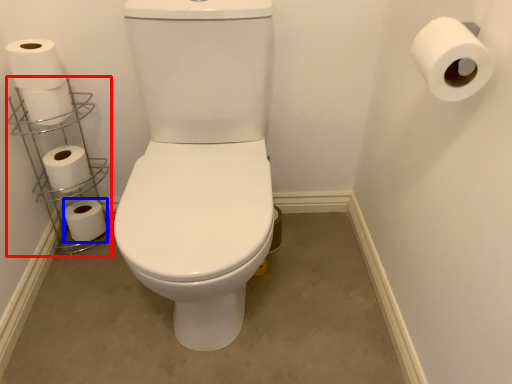
Question: Which point is closer to the camera, shelf (highlighted by a red box) or toilet paper (highlighted by a blue box)?

Choices:
 (A) shelf
 (B) toilet paper

Answer: (A)